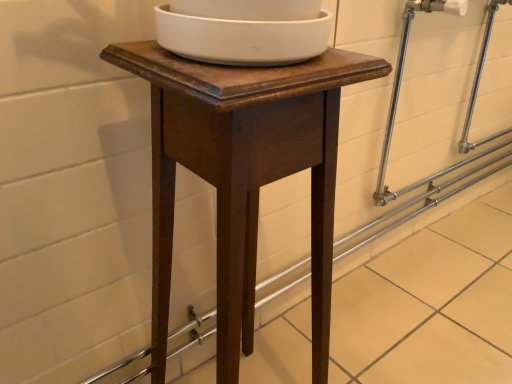
The width and height of the screenshot is (512, 384). Identify the location of dark wood pedestal at center. 242,174.

What do you see at coordinates (242, 174) in the screenshot? This screenshot has height=384, width=512. I see `dark wood pedestal at center` at bounding box center [242, 174].

In order to click on dark wood pedestal at center in this screenshot , I will do [242, 174].